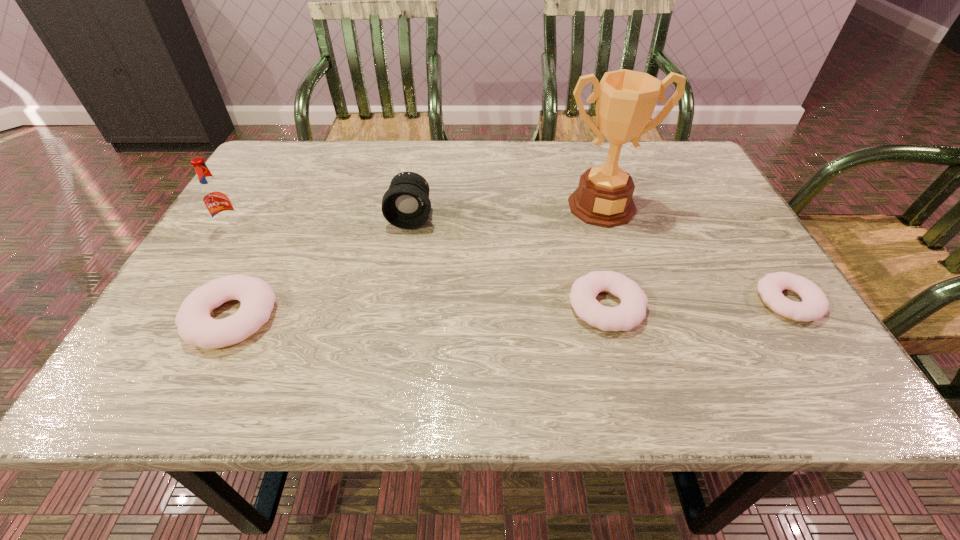
Identify the location of free spot between the shortest doughnut and the leftmost doughnut. (510, 309).

Locate an element on the screen. Image resolution: width=960 pixels, height=540 pixels. vacant space that is in between the second shortest doughnut and the second tallest object is located at coordinates (420, 268).

Identify the location of empty location between the third object from left to right and the leftmost doughnut. (321, 267).

This screenshot has height=540, width=960. What are the coordinates of `vacant area between the telephoto lens and the root beer` in the screenshot? It's located at coord(322,223).

In order to click on blank region between the fifth tallest object and the award in this screenshot , I will do `click(604, 256)`.

Find the location of a particular element. vacant area that lies between the rightmost doughnut and the second tallest object is located at coordinates (510, 265).

Identify the location of free point between the shortest doughnut and the third object from left to right. (600, 259).

You are a GUI agent. You are given a task and a screenshot of the screen. Output one action in this format:
    pyautogui.click(x=<x>, y=<y>)
    Task: Click on the object that is the closest to the leftmost doughnut
    
    Given the screenshot: What is the action you would take?
    pyautogui.click(x=215, y=197)

Find the location of `the fifth closest object to the rightmost object`. the fifth closest object to the rightmost object is located at coordinates (215, 197).

Identify which doughnut is the second closest to the shortest object. Please provide its 2D coordinates. Your answer should be formatted as a tuple, i.e. [(x, y)], where the tuple contains the x and y coordinates of a point satisfying the conditions above.

[(196, 327)]